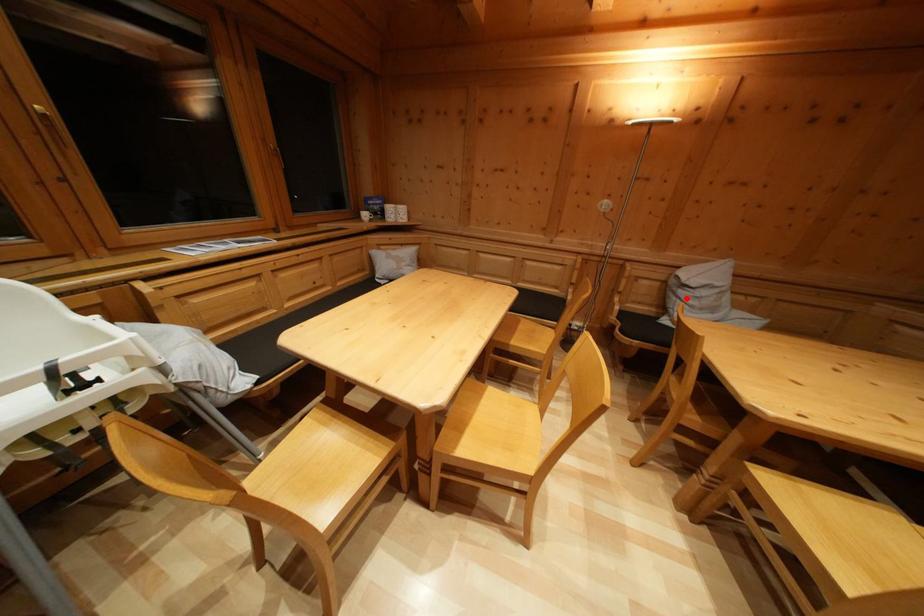
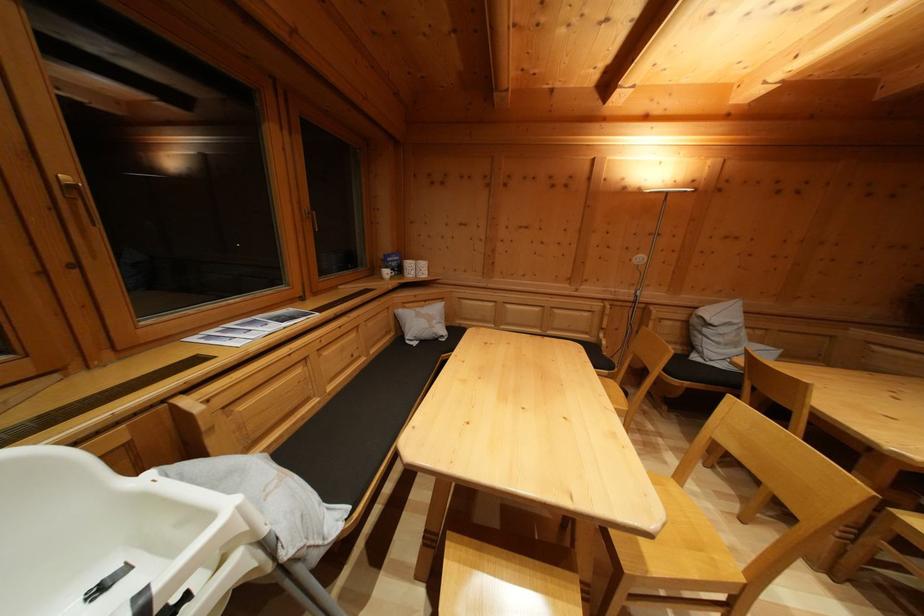
The point at the highlighted location is marked in the first image. Where is the corresponding point in the second image?

(711, 337)